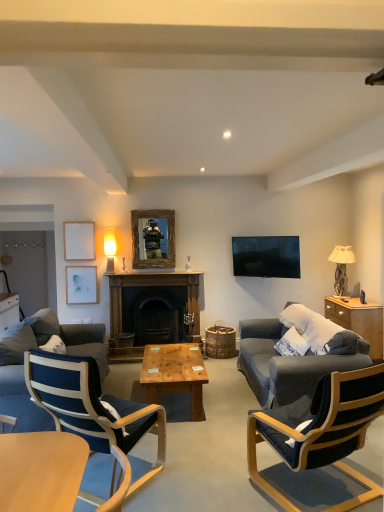
Question: Is blue fabric chair at lower left, which is counted as the 2th chair, starting from the right, aimed at dark blue fabric chair at right, which is the first chair in right-to-left order?

Choices:
 (A) no
 (B) yes

Answer: (A)

Question: Can you confirm if blue fabric chair at lower left, which is counted as the 2th chair, starting from the right, is positioned to the right of dark blue fabric chair at right, the 2th chair positioned from the left?

Choices:
 (A) no
 (B) yes

Answer: (A)

Question: Does blue fabric chair at lower left, which is counted as the 2th chair, starting from the right, contain dark blue fabric chair at right, the 2th chair positioned from the left?

Choices:
 (A) no
 (B) yes

Answer: (A)

Question: Is blue fabric chair at lower left, the 1th chair from the left, looking in the opposite direction of dark blue fabric chair at right, which is the first chair in right-to-left order?

Choices:
 (A) yes
 (B) no

Answer: (B)

Question: Is blue fabric chair at lower left, the 1th chair from the left, bigger than dark blue fabric chair at right, the 2th chair positioned from the left?

Choices:
 (A) yes
 (B) no

Answer: (B)

Question: From a real-world perspective, is wooden frame mirror at center above or below dark wood fireplace at center?

Choices:
 (A) above
 (B) below

Answer: (A)

Question: Relative to dark wood fireplace at center, is wooden frame mirror at center in front or behind?

Choices:
 (A) front
 (B) behind

Answer: (B)

Question: Choose the correct answer: Is wooden frame mirror at center inside dark wood fireplace at center or outside it?

Choices:
 (A) inside
 (B) outside

Answer: (B)

Question: Is wooden frame mirror at center wider or thinner than dark wood fireplace at center?

Choices:
 (A) thin
 (B) wide

Answer: (A)

Question: Is dark wood fireplace at center spatially inside dark gray fabric couch at left, or outside of it?

Choices:
 (A) inside
 (B) outside

Answer: (B)

Question: Is dark wood fireplace at center wider or thinner than dark gray fabric couch at left?

Choices:
 (A) thin
 (B) wide

Answer: (A)

Question: Is point tap(178, 290) positioned closer to the camera than point tap(67, 340)?

Choices:
 (A) closer
 (B) farther

Answer: (B)

Question: In the image, is dark wood fireplace at center positioned in front of or behind dark gray fabric couch at left?

Choices:
 (A) front
 (B) behind

Answer: (B)

Question: In the image, is wooden cabinet at right, the 1th cabinetry in the front-to-back sequence, on the left side or the right side of dark blue fabric chair at right, which is the first chair in right-to-left order?

Choices:
 (A) right
 (B) left

Answer: (A)

Question: From the image's perspective, is wooden cabinet at right, the second cabinetry viewed from the left, positioned above or below dark blue fabric chair at right, which is the first chair in right-to-left order?

Choices:
 (A) below
 (B) above

Answer: (B)